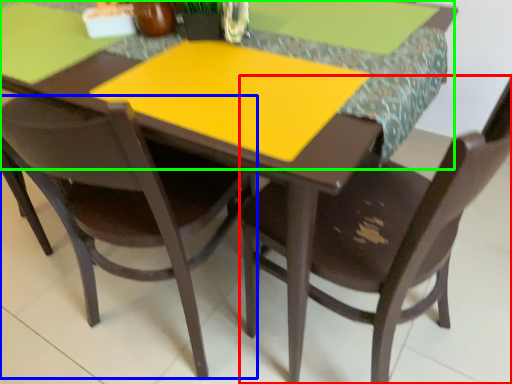
Question: Estimate the real-world distances between objects in this image. Which object is farther from chair (highlighted by a red box), chair (highlighted by a blue box) or counter top (highlighted by a green box)?

Choices:
 (A) chair
 (B) counter top

Answer: (A)